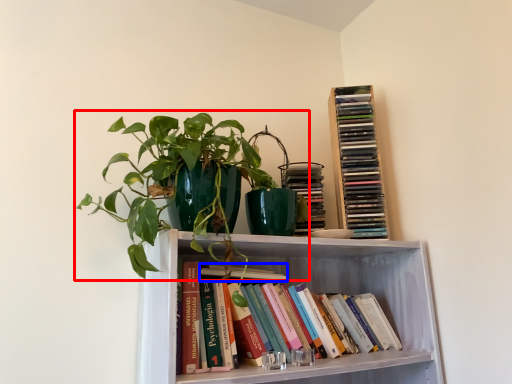
Question: Which object is further to the camera taking this photo, houseplant (highlighted by a red box) or book (highlighted by a blue box)?

Choices:
 (A) houseplant
 (B) book

Answer: (B)